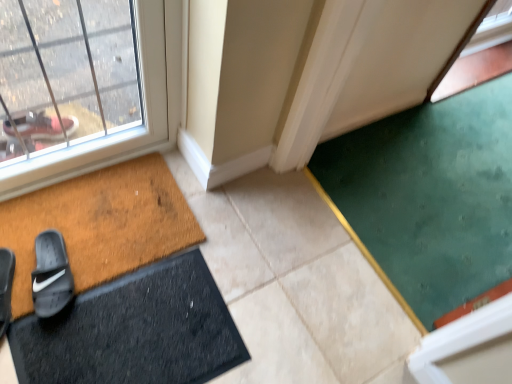
Where is `blank space above black rubber bath mat at lower left, which is the second bath mat in top-to-bottom order (from a real-world perspective)`? The width and height of the screenshot is (512, 384). blank space above black rubber bath mat at lower left, which is the second bath mat in top-to-bottom order (from a real-world perspective) is located at coordinates (136, 330).